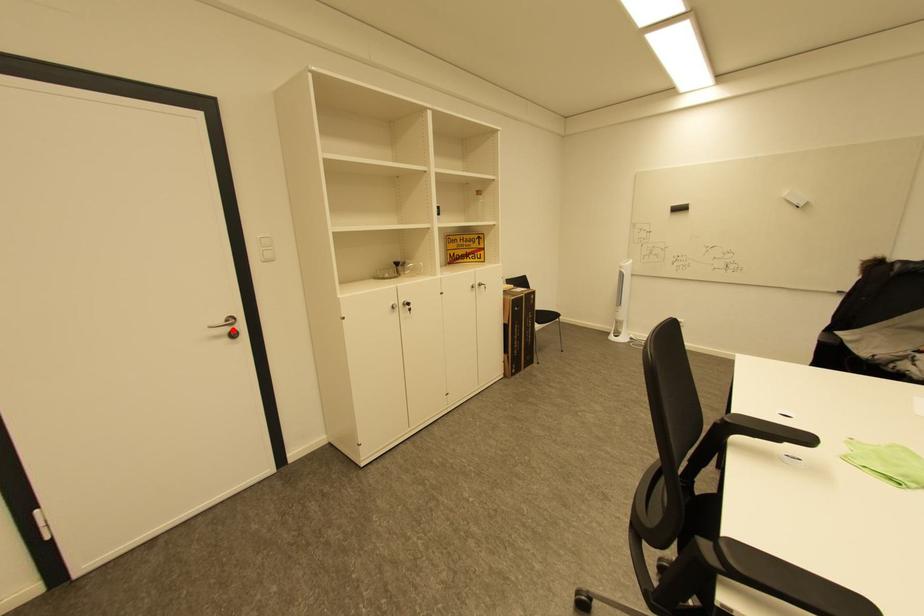
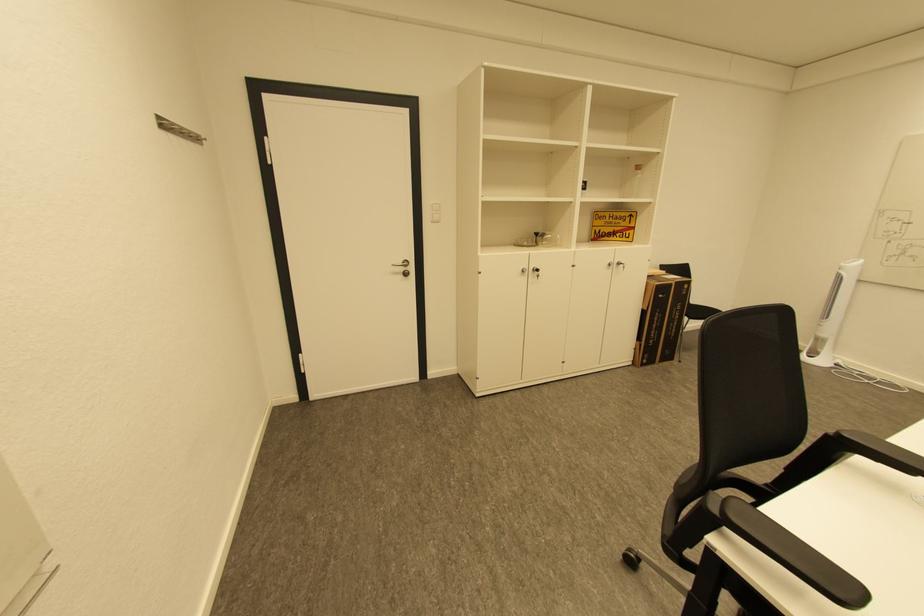
In the second image, find the point that corresponds to the highlighted location in the first image.

(408, 270)